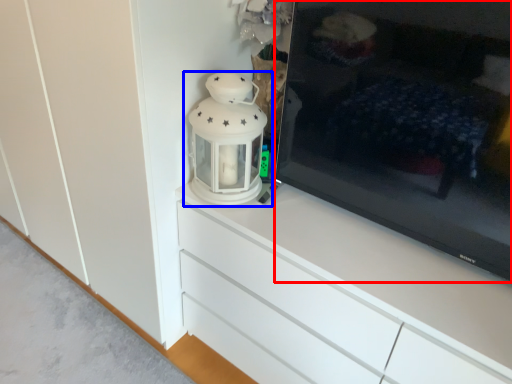
Question: Which object appears farthest to the camera in this image, television (highlighted by a red box) or lantern (highlighted by a blue box)?

Choices:
 (A) television
 (B) lantern

Answer: (B)